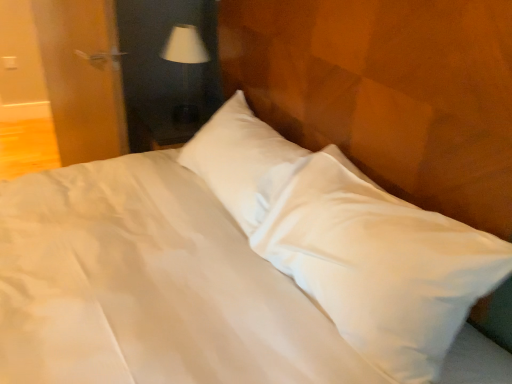
Locate an element on the screen. This screenshot has width=512, height=384. wooden door at left is located at coordinates (82, 77).

Describe the element at coordinates (185, 67) in the screenshot. I see `white fabric lampshade at upper center` at that location.

You are a GUI agent. You are given a task and a screenshot of the screen. Output one action in this format:
    pyautogui.click(x=<x>, y=<y>)
    Task: Click on the wooden door at left
    This screenshot has width=512, height=384.
    Given the screenshot: What is the action you would take?
    [x=82, y=77]

Which object is closer to the camera taking this photo, white plastic electric outlet at upper left or wooden door at left?

wooden door at left is in front.

Is point (9, 58) positioned behind point (47, 22)?

Yes, point (9, 58) is farther from viewer.

Is white plastic electric outlet at upper left thinner than wooden door at left?

Yes, white plastic electric outlet at upper left is thinner than wooden door at left.

Is white fabric lampshade at upper center positioned beyond the bounds of white plastic electric outlet at upper left?

Yes, white fabric lampshade at upper center is located beyond the bounds of white plastic electric outlet at upper left.

From the image's perspective, is white fabric lampshade at upper center above or below white plastic electric outlet at upper left?

white fabric lampshade at upper center is situated lower than white plastic electric outlet at upper left in the image.

This screenshot has width=512, height=384. I want to click on electric outlet that appears below the white fabric lampshade at upper center (from a real-world perspective), so click(9, 62).

Is white fabric lampshade at upper center looking in the opposite direction of white plastic electric outlet at upper left?

No.

Does wooden door at left contain white fabric lampshade at upper center?

Definitely not — white fabric lampshade at upper center is not inside wooden door at left.

How many degrees apart are the facing directions of wooden door at left and white fabric lampshade at upper center?

The angular difference between wooden door at left and white fabric lampshade at upper center is 8.84 degrees.

Who is smaller, wooden door at left or white fabric lampshade at upper center?

white fabric lampshade at upper center is smaller.

Locate an element on the screen. door located below the white fabric lampshade at upper center (from the image's perspective) is located at coordinates (82, 77).

Is white fabric lampshade at upper center next to wooden door at left?

No, white fabric lampshade at upper center is not next to wooden door at left.

From a real-world perspective, which object rests below the other?

In real-world perspective, wooden door at left is lower.

In terms of size, does white fabric lampshade at upper center appear bigger or smaller than wooden door at left?

Considering their sizes, white fabric lampshade at upper center takes up less space than wooden door at left.

Is point (110, 97) closer to viewer compared to point (15, 68)?

Yes, it is in front of point (15, 68).

Is wooden door at left inside the boundaries of white plastic electric outlet at upper left, or outside?

wooden door at left is not inside white plastic electric outlet at upper left, it's outside.

Is wooden door at left far away from white plastic electric outlet at upper left?

That's right, there is a large distance between wooden door at left and white plastic electric outlet at upper left.

Does wooden door at left appear on the left side of white plastic electric outlet at upper left?

In fact, wooden door at left is to the right of white plastic electric outlet at upper left.

Which point is more distant from viewer, (9, 59) or (193, 58)?

The point (9, 59) is more distant.

Between white plastic electric outlet at upper left and white fabric lampshade at upper center, which one has larger size?

With larger size is white fabric lampshade at upper center.

From the image's perspective, between white plastic electric outlet at upper left and white fabric lampshade at upper center, who is located below?

white fabric lampshade at upper center.

Is white plastic electric outlet at upper left placed right next to white fabric lampshade at upper center?

There is a gap between white plastic electric outlet at upper left and white fabric lampshade at upper center.

At what (x,y) coordinates should I click in order to perform the action: click on door located on the right of white plastic electric outlet at upper left. Please return your answer as a coordinate pair (x, y). Looking at the image, I should click on (82, 77).

The image size is (512, 384). I want to click on table lamp that is above the white plastic electric outlet at upper left (from a real-world perspective), so click(185, 67).

Estimate the real-world distances between objects in this image. Which object is closer to white fabric lampshade at upper center, wooden door at left or white plastic electric outlet at upper left?

wooden door at left is positioned closer to the anchor white fabric lampshade at upper center.

Considering their positions, is white fabric lampshade at upper center positioned further to wooden door at left than white plastic electric outlet at upper left?

white plastic electric outlet at upper left is positioned further to the anchor wooden door at left.

Which object lies further to the anchor point wooden door at left, white plastic electric outlet at upper left or white fabric lampshade at upper center?

Among the two, white plastic electric outlet at upper left is located further to wooden door at left.

Based on their spatial positions, is white plastic electric outlet at upper left or wooden door at left further from white fabric lampshade at upper center?

Among the two, white plastic electric outlet at upper left is located further to white fabric lampshade at upper center.

From the image, which object appears to be farther from white plastic electric outlet at upper left, wooden door at left or white fabric lampshade at upper center?

Based on the image, white fabric lampshade at upper center appears to be further to white plastic electric outlet at upper left.

Estimate the real-world distances between objects in this image. Which object is closer to white plastic electric outlet at upper left, white fabric lampshade at upper center or wooden door at left?

Among the two, wooden door at left is located nearer to white plastic electric outlet at upper left.

Where is `table lamp positioned between wooden door at left and white plastic electric outlet at upper left from near to far`? table lamp positioned between wooden door at left and white plastic electric outlet at upper left from near to far is located at coordinates (185, 67).